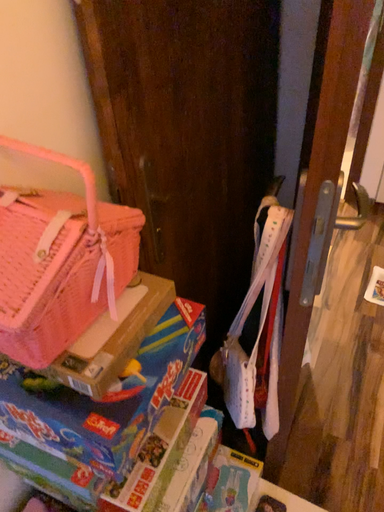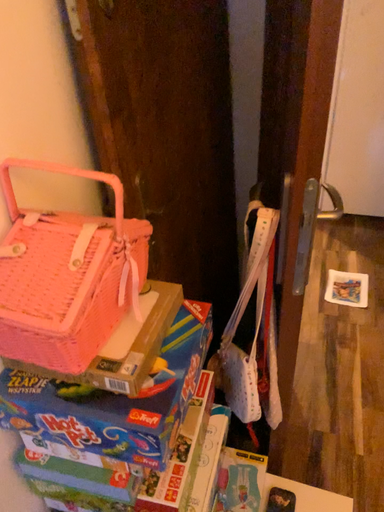
Question: Which way did the camera rotate in the video?

Choices:
 (A) rotated left
 (B) rotated right

Answer: (B)